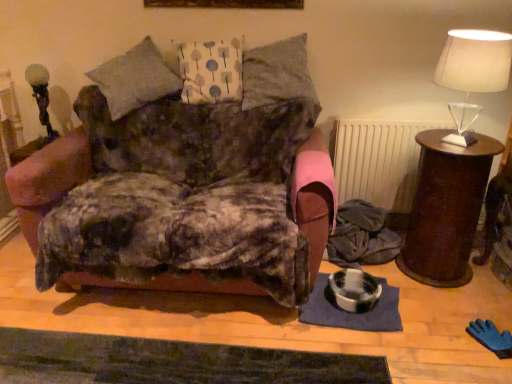
You are a GUI agent. You are given a task and a screenshot of the screen. Output one action in this format:
    pyautogui.click(x=<x>, y=<y>)
    Task: Click on the vacant area that is in front of brown wooden side table at right
    
    Given the screenshot: What is the action you would take?
    pyautogui.click(x=452, y=307)